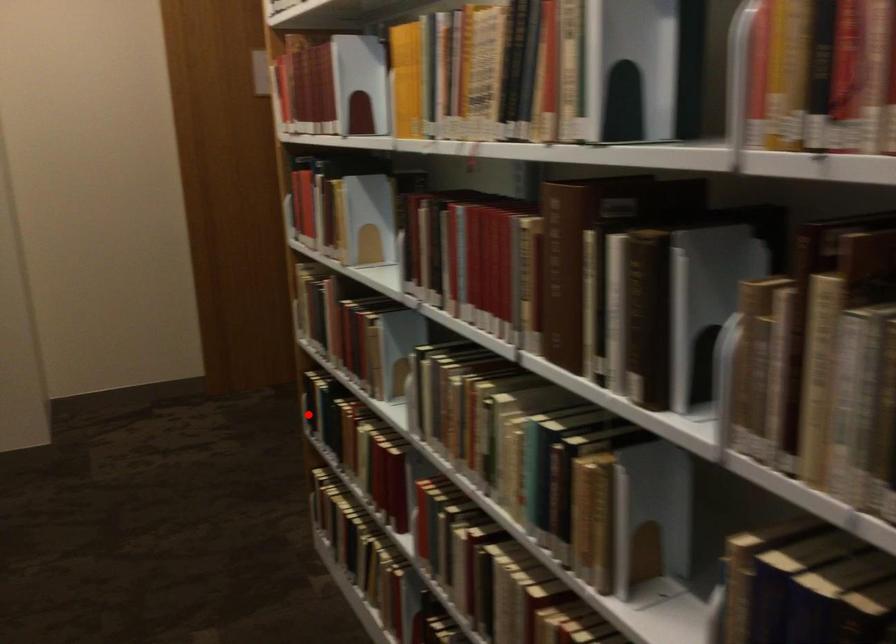
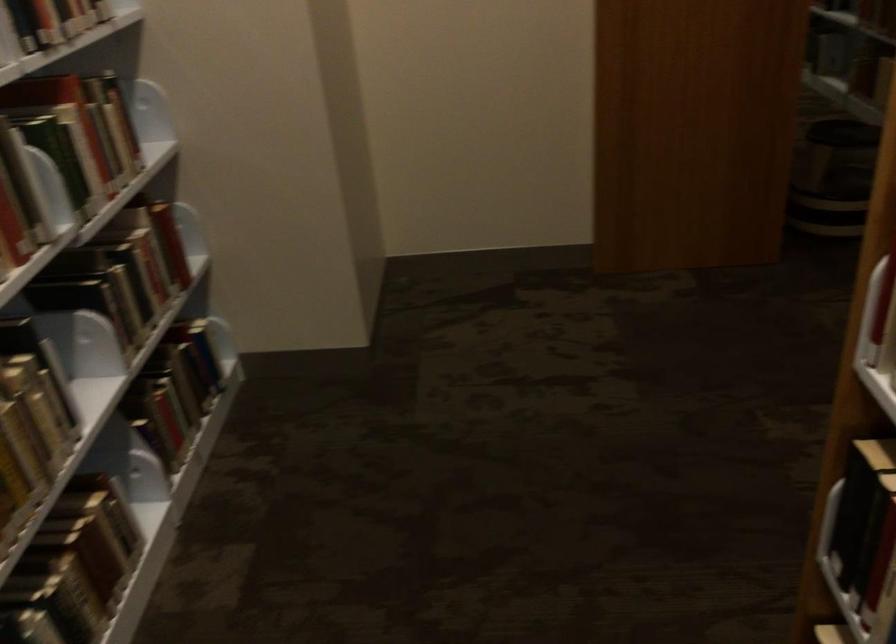
Question: I am providing you with two images of the same scene from different viewpoints. In image1, a red point is highlighted. Considering the same 3D point in image2, which of the following is correct?

Choices:
 (A) It is closer
 (B) It is farther

Answer: (A)